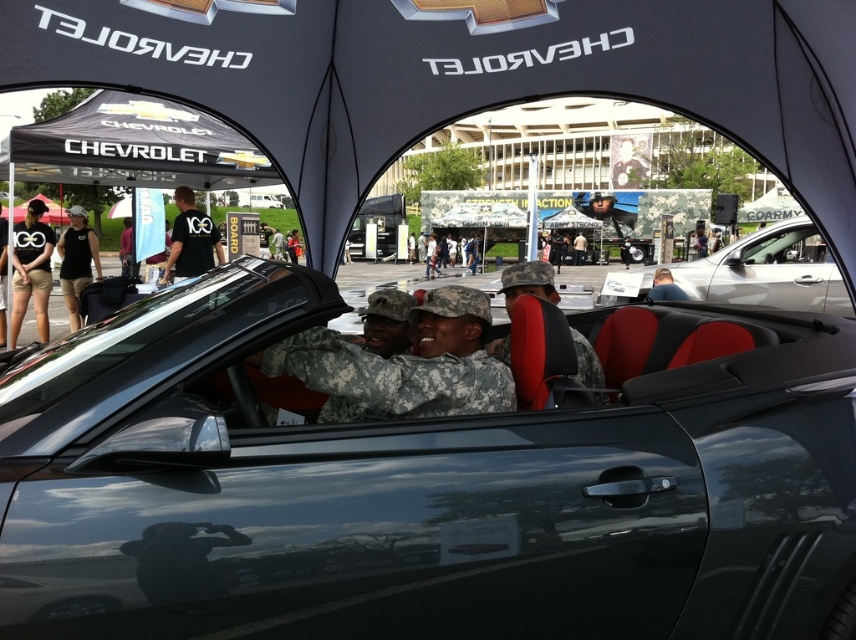
You are standing in front of the Chevrolet canopy tent and see the camouflage fabric uniform at center and the silver metallic car at center. Which object is nearer to you?

The camouflage fabric uniform at center is closer to the viewer than the silver metallic car at center.

You are a photographer at the event and want to take a photo of both the camouflage fabric uniform at center and the silver metallic car at center. Which object should you position to the left side of your camera frame to include both in the shot?

The camouflage fabric uniform at center is to the left of silver metallic car at center, so you should position the camouflage fabric uniform at center on the left side of your camera frame to include both in the shot.